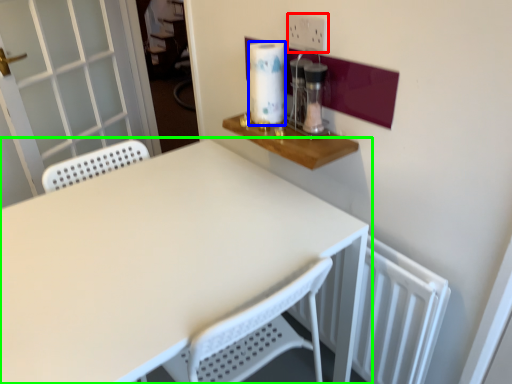
Question: Which object is the closest to the electric outlet (highlighted by a red box)? Choose among these: paper towel (highlighted by a blue box) or table (highlighted by a green box).

Choices:
 (A) paper towel
 (B) table

Answer: (A)